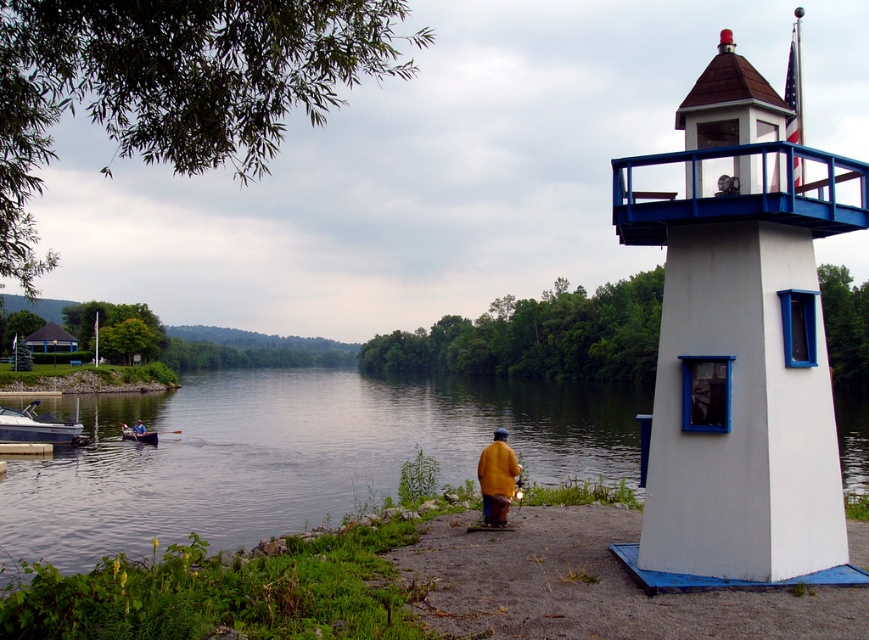
You are a photographer planning to take a photo of the smooth water at center and the white glossy boat at left. Based on their positions in the image, which object appears larger in the photo?

The smooth water at center appears larger in the photo because it is much taller than the white glossy boat at left.

You are a photographer trying to capture a photo of the white glossy boat at left without the yellow matte jacket at center blocking the view. Based on their heights, is this possible?

The yellow matte jacket at center is not as tall as the white glossy boat at left, so it is possible to capture the white glossy boat at left without the jacket blocking the view by positioning the camera lower or adjusting the angle to avoid the jacket.

You are standing at the edge of the river and want to walk towards the white painted wood lighthouse at right while avoiding the yellow matte jacket at center. Which direction should you move relative to the jacket?

You should move to the right of the yellow matte jacket at center because the white painted wood lighthouse at right is located to the right of the jacket.